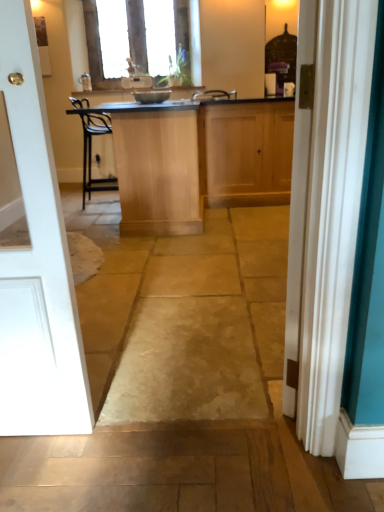
The image size is (384, 512). I want to click on vacant space situated on the left part of teal fabric curtain at right, so click(219, 366).